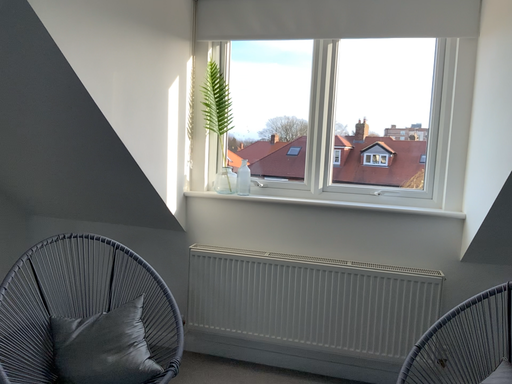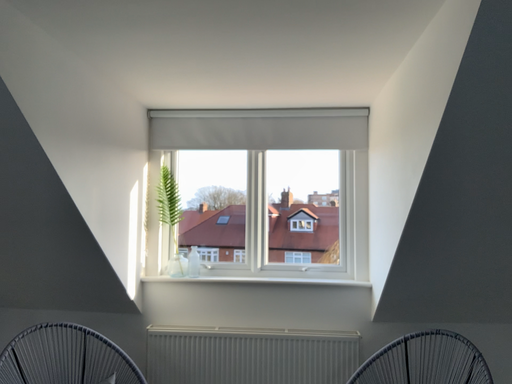
Question: How did the camera likely rotate when shooting the video?

Choices:
 (A) rotated right
 (B) rotated left

Answer: (A)